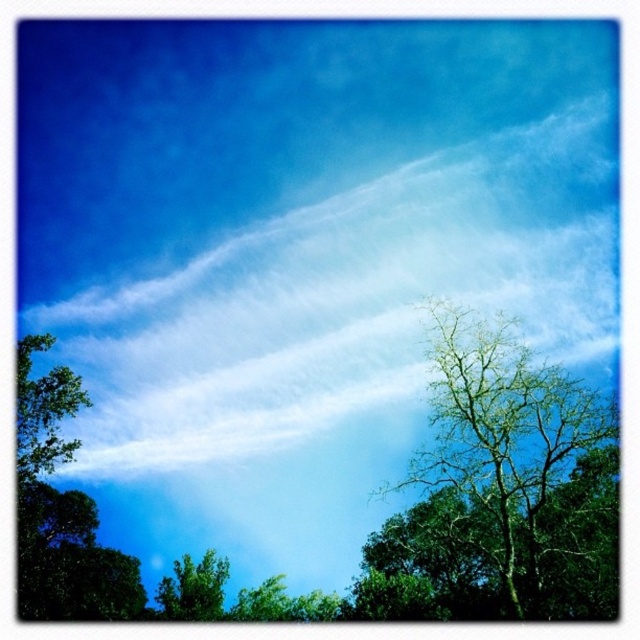
You are standing in a field and see the green leafy tree at left and the green leafy tree at lower center. Which tree is positioned higher in the image?

The green leafy tree at left is positioned higher than the green leafy tree at lower center according to the description.

You are standing in a forest and see the green leafy tree at left and the green leafy tree at lower center. Which tree would you need to look up higher to see the top of?

A: The green leafy tree at left is taller than the green leafy tree at lower center, so you would need to look up higher to see the top of the green leafy tree at left.